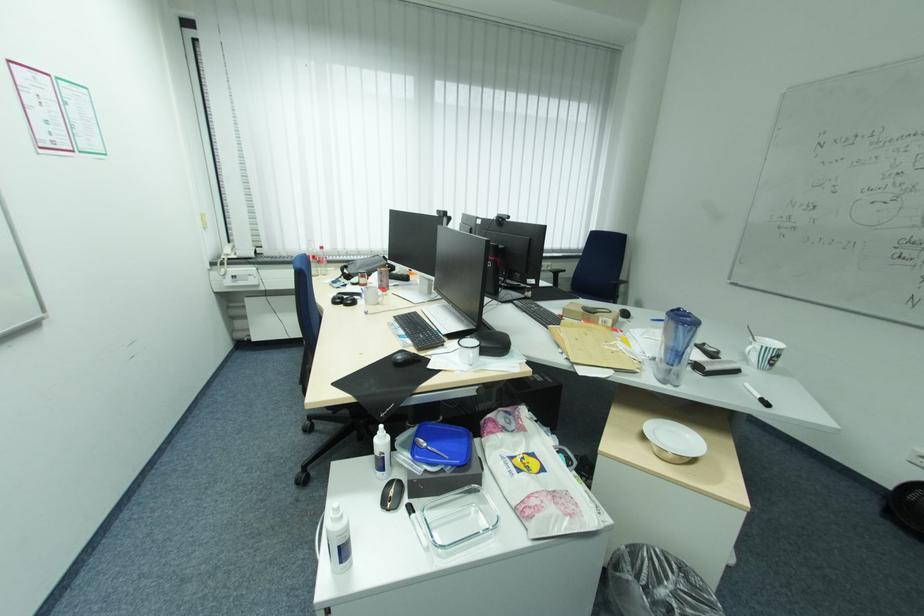
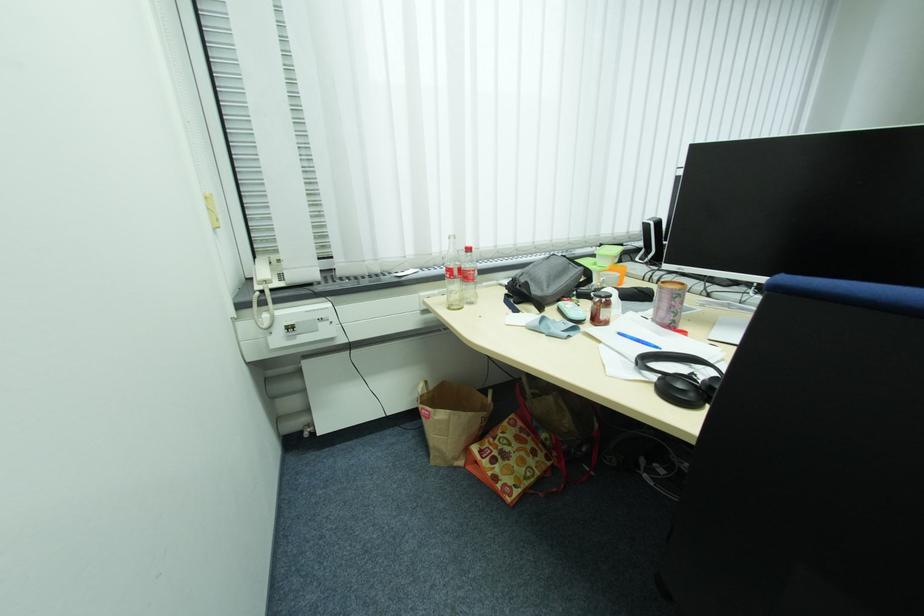
Find the pixel in the second image that matches (x=387, y=270) in the first image.

(687, 290)